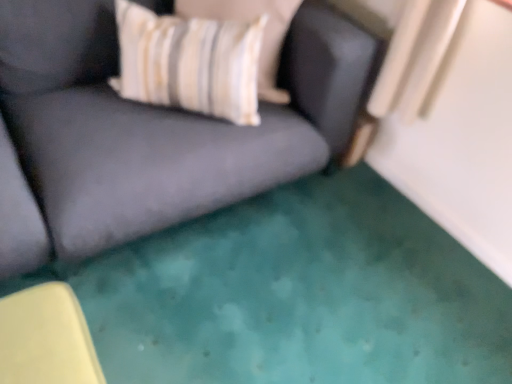
What do you see at coordinates (189, 63) in the screenshot? This screenshot has height=384, width=512. I see `white striped fabric pillow at upper left` at bounding box center [189, 63].

The image size is (512, 384). Identify the location of white striped fabric pillow at upper left. (189, 63).

Is velvet dark gray couch at center wider than striped fabric pillow at upper center?

Indeed, velvet dark gray couch at center has a greater width compared to striped fabric pillow at upper center.

Is velvet dark gray couch at center facing towards striped fabric pillow at upper center?

Yes, velvet dark gray couch at center is facing striped fabric pillow at upper center.

Between point (115, 180) and point (250, 19), which one is positioned in front?

The point (115, 180) is closer to the camera.

Is white striped fabric pillow at upper left outside of striped fabric pillow at upper center?

Yes.

In terms of size, does white striped fabric pillow at upper left appear bigger or smaller than striped fabric pillow at upper center?

Considering their sizes, white striped fabric pillow at upper left takes up more space than striped fabric pillow at upper center.

How many degrees apart are the facing directions of white striped fabric pillow at upper left and striped fabric pillow at upper center?

14.2 degrees separate the facing orientations of white striped fabric pillow at upper left and striped fabric pillow at upper center.

Is the depth of white striped fabric pillow at upper left greater than that of striped fabric pillow at upper center?

No, the depth of white striped fabric pillow at upper left is less than that of striped fabric pillow at upper center.

From the image's perspective, does striped fabric pillow at upper center appear lower than white striped fabric pillow at upper left?

No.

Could you tell me if striped fabric pillow at upper center is facing white striped fabric pillow at upper left?

Yes, striped fabric pillow at upper center is aimed at white striped fabric pillow at upper left.

Looking at the image, does striped fabric pillow at upper center seem bigger or smaller compared to white striped fabric pillow at upper left?

striped fabric pillow at upper center is smaller than white striped fabric pillow at upper left.

Looking at this image, which is more distant, (286, 95) or (167, 79)?

Positioned behind is point (286, 95).

Considering the relative positions of velvet dark gray couch at center and white striped fabric pillow at upper left in the image provided, is velvet dark gray couch at center to the right of white striped fabric pillow at upper left from the viewer's perspective?

No.

Does velvet dark gray couch at center turn towards white striped fabric pillow at upper left?

Yes, velvet dark gray couch at center is oriented towards white striped fabric pillow at upper left.

From the image's perspective, does velvet dark gray couch at center appear lower than white striped fabric pillow at upper left?

Yes, from the image's perspective, velvet dark gray couch at center is below white striped fabric pillow at upper left.

Is velvet dark gray couch at center placed right next to white striped fabric pillow at upper left?

No.

Which of these two, striped fabric pillow at upper center or velvet dark gray couch at center, stands taller?

Standing taller between the two is velvet dark gray couch at center.

From the image's perspective, is striped fabric pillow at upper center located beneath velvet dark gray couch at center?

No, from the image's perspective, striped fabric pillow at upper center is not beneath velvet dark gray couch at center.

Where is `pillow that is on the right side of velvet dark gray couch at center`? The width and height of the screenshot is (512, 384). pillow that is on the right side of velvet dark gray couch at center is located at coordinates (263, 33).

Is white striped fabric pillow at upper left oriented away from velvet dark gray couch at center?

Yes, velvet dark gray couch at center is at the back of white striped fabric pillow at upper left.

Considering the positions of point (257, 45) and point (357, 33), is point (257, 45) closer or farther from the camera than point (357, 33)?

Clearly, point (257, 45) is closer to the camera than point (357, 33).

Who is taller, white striped fabric pillow at upper left or velvet dark gray couch at center?

Standing taller between the two is velvet dark gray couch at center.

In the image, there is a velvet dark gray couch at center. Where is `pillow above it (from the image's perspective)`? pillow above it (from the image's perspective) is located at coordinates (263, 33).

Where is `pillow behind the white striped fabric pillow at upper left`? pillow behind the white striped fabric pillow at upper left is located at coordinates (263, 33).

Based on their spatial positions, is velvet dark gray couch at center or white striped fabric pillow at upper left further from striped fabric pillow at upper center?

velvet dark gray couch at center lies further to striped fabric pillow at upper center than the other object.

When comparing their distances from striped fabric pillow at upper center, does white striped fabric pillow at upper left or velvet dark gray couch at center seem further?

velvet dark gray couch at center lies further to striped fabric pillow at upper center than the other object.

Estimate the real-world distances between objects in this image. Which object is further from white striped fabric pillow at upper left, striped fabric pillow at upper center or velvet dark gray couch at center?

Among the two, velvet dark gray couch at center is located further to white striped fabric pillow at upper left.

Which object lies further to the anchor point velvet dark gray couch at center, striped fabric pillow at upper center or white striped fabric pillow at upper left?

striped fabric pillow at upper center is positioned further to the anchor velvet dark gray couch at center.

When comparing their distances from velvet dark gray couch at center, does white striped fabric pillow at upper left or striped fabric pillow at upper center seem closer?

The object closer to velvet dark gray couch at center is white striped fabric pillow at upper left.

Looking at the image, which one is located closer to white striped fabric pillow at upper left, velvet dark gray couch at center or striped fabric pillow at upper center?

striped fabric pillow at upper center is positioned closer to the anchor white striped fabric pillow at upper left.

Locate an element on the screen. Image resolution: width=512 pixels, height=384 pixels. throw pillow positioned between velvet dark gray couch at center and striped fabric pillow at upper center from near to far is located at coordinates (189, 63).